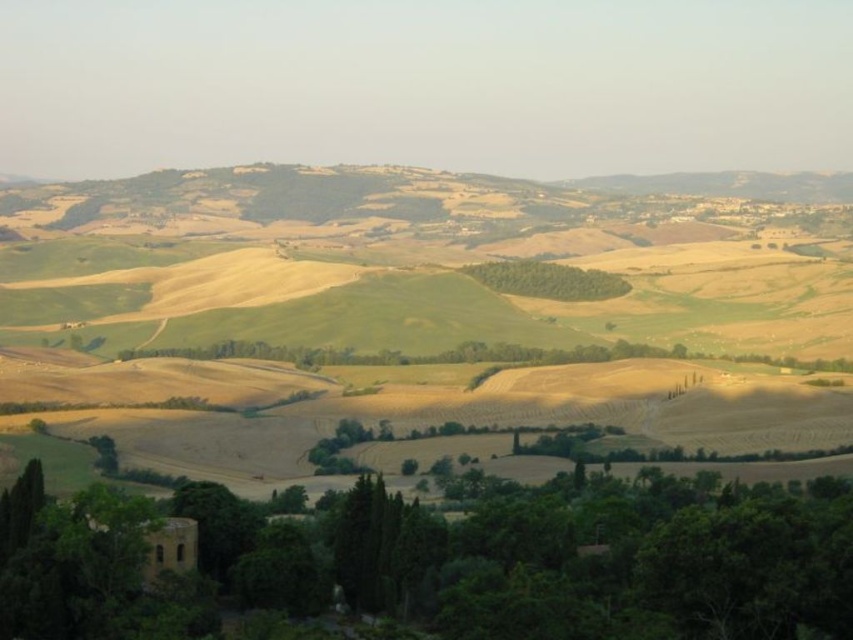
Is green leafy tree at lower center taller than green leafy trees at center?

Incorrect, green leafy tree at lower center's height is not larger of green leafy trees at center's.

Which is in front, point (726, 604) or point (515, 268)?

Point (726, 604)

Where is `green leafy tree at lower center`? The width and height of the screenshot is (853, 640). green leafy tree at lower center is located at coordinates (450, 561).